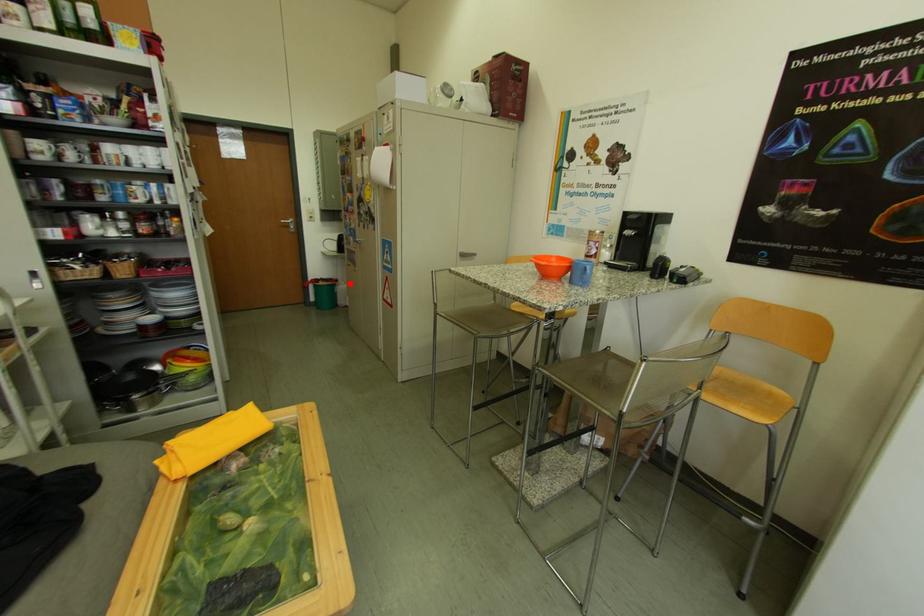
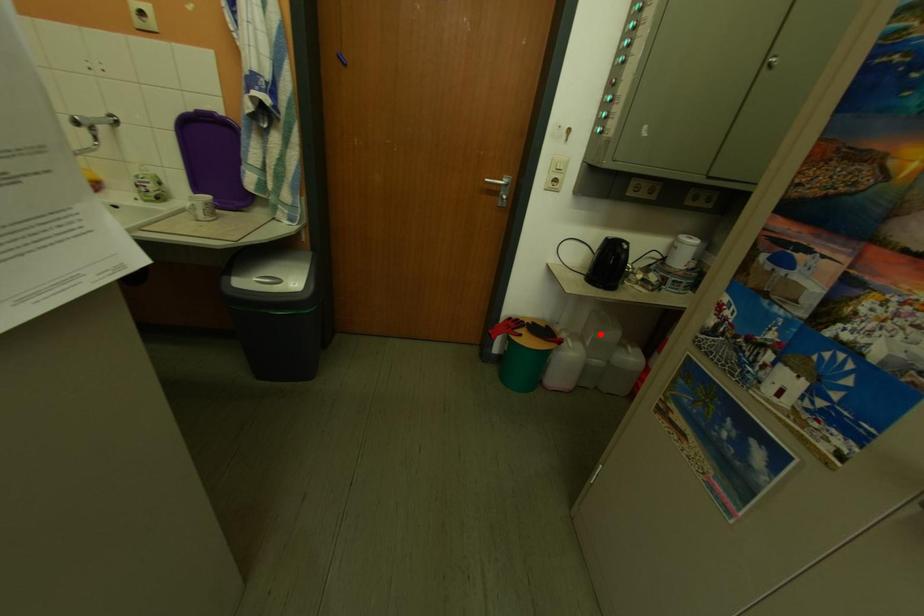
I am providing you with two images of the same scene from different viewpoints. A red point is marked on the first image and another point is marked on the second image. Is the red point in image1 aligned with the point shown in image2?

No